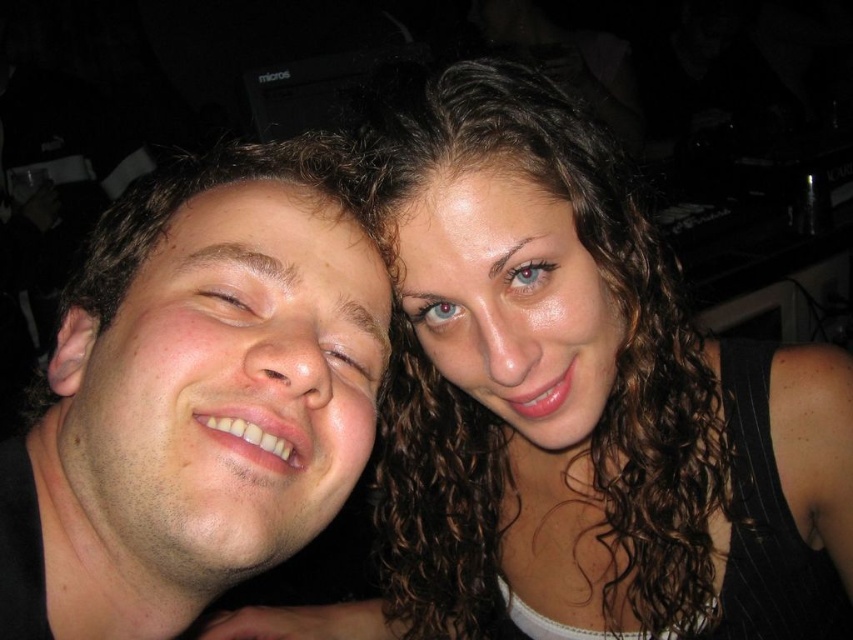
Which of these two, curly hair at center or matte skin face at center, stands shorter?

matte skin face at center

Between point (529, 140) and point (173, 346), which one is positioned in front?

Positioned in front is point (173, 346).

What do you see at coordinates (575, 406) in the screenshot? I see `curly hair at center` at bounding box center [575, 406].

Locate an element on the screen. curly hair at center is located at coordinates pyautogui.click(x=575, y=406).

What do you see at coordinates (575, 406) in the screenshot? I see `curly hair at center` at bounding box center [575, 406].

Consider the image. Can you confirm if curly hair at center is positioned below shiny brown hair at center?

Yes, curly hair at center is below shiny brown hair at center.

Who is more forward, [717,433] or [519,385]?

Point [519,385]

The image size is (853, 640). In order to click on curly hair at center in this screenshot , I will do `click(575, 406)`.

The width and height of the screenshot is (853, 640). What do you see at coordinates (229, 381) in the screenshot?
I see `matte skin face at center` at bounding box center [229, 381].

Between point (282, 280) and point (447, 355), which one is positioned in front?

Point (282, 280) is in front.

Where is `matte skin face at center`? matte skin face at center is located at coordinates (229, 381).